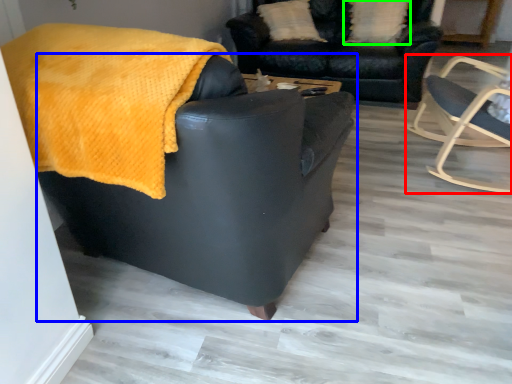
Question: Estimate the real-world distances between objects in this image. Which object is farther from chair (highlighted by a red box), chair (highlighted by a blue box) or pillow (highlighted by a green box)?

Choices:
 (A) chair
 (B) pillow

Answer: (A)